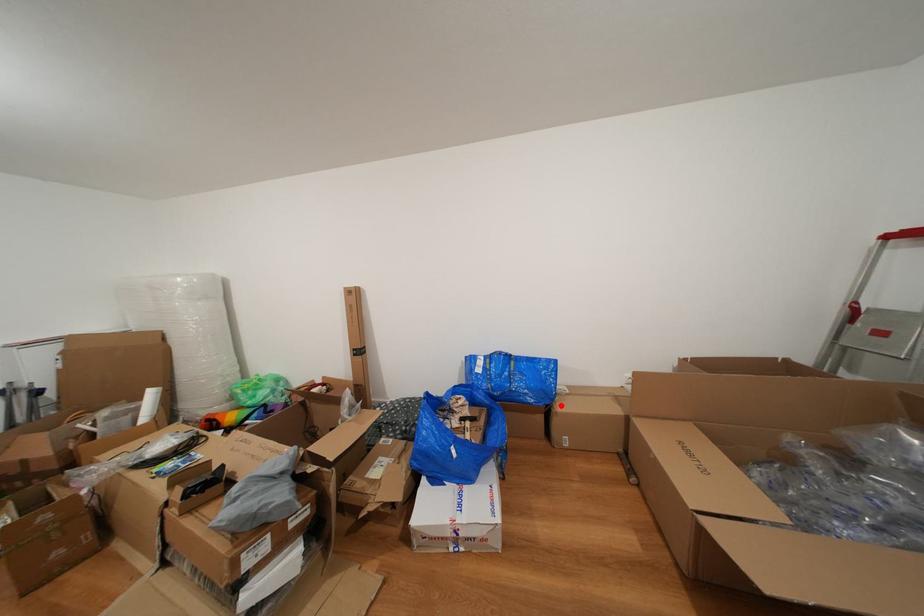
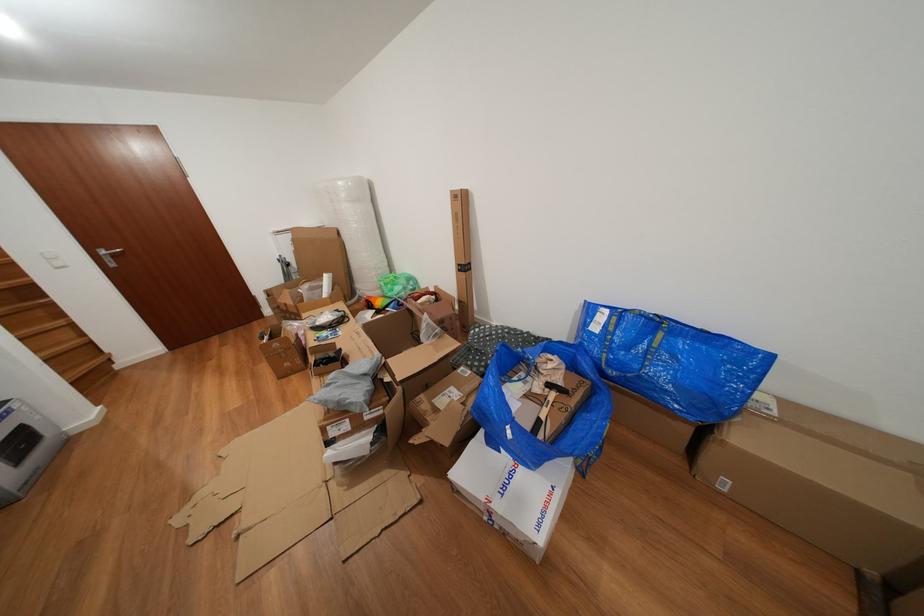
Find the pixel in the second image that matches the highlighted location in the first image.

(734, 424)